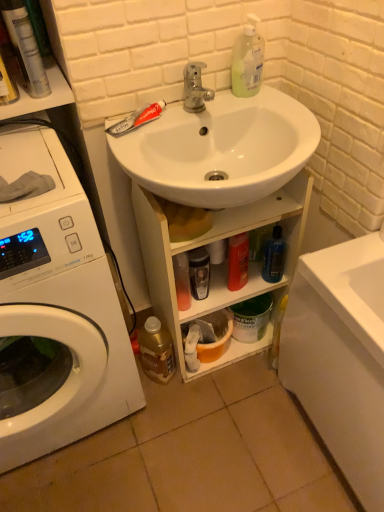
Question: Can you confirm if white glossy washing machine at left is positioned to the right of shiny black bottle at center, the 2th toiletry when ordered from back to front?

Choices:
 (A) yes
 (B) no

Answer: (B)

Question: Can shiny black bottle at center, the 2th toiletry when ordered from front to back, be found inside white glossy washing machine at left?

Choices:
 (A) yes
 (B) no

Answer: (B)

Question: From a real-world perspective, does white glossy washing machine at left stand above shiny black bottle at center, which appears as the 1th toiletry when ordered from the bottom?

Choices:
 (A) yes
 (B) no

Answer: (A)

Question: From the image's perspective, is white glossy washing machine at left located beneath shiny black bottle at center, arranged as the 2th toiletry when viewed from the right?

Choices:
 (A) no
 (B) yes

Answer: (B)

Question: Is white glossy washing machine at left facing towards shiny black bottle at center, the 2th toiletry viewed from the left?

Choices:
 (A) yes
 (B) no

Answer: (B)

Question: Does point (140, 336) appear closer or farther from the camera than point (271, 278)?

Choices:
 (A) closer
 (B) farther

Answer: (B)

Question: Is gold metallic bottle at lower left, positioned as the 2th bottle in top-to-bottom order, taller or shorter than blue translucent bottle at lower center, the first bottle positioned from the right?

Choices:
 (A) short
 (B) tall

Answer: (B)

Question: In terms of size, does gold metallic bottle at lower left, which ranks as the first bottle in left-to-right order, appear bigger or smaller than blue translucent bottle at lower center, the first bottle positioned from the right?

Choices:
 (A) small
 (B) big

Answer: (B)

Question: From a real-world perspective, is gold metallic bottle at lower left, the first bottle when ordered from bottom to top, physically located above or below blue translucent bottle at lower center, the 2th bottle from the left?

Choices:
 (A) above
 (B) below

Answer: (B)

Question: From a real-world perspective, is red matte toothpaste at upper left positioned above or below metallic silver spray can at upper left, the 3th toiletry positioned from the back?

Choices:
 (A) above
 (B) below

Answer: (B)

Question: Considering the positions of red matte toothpaste at upper left and metallic silver spray can at upper left, the first toiletry when ordered from left to right, in the image, is red matte toothpaste at upper left bigger or smaller than metallic silver spray can at upper left, the first toiletry when ordered from left to right,?

Choices:
 (A) small
 (B) big

Answer: (A)

Question: Is red matte toothpaste at upper left taller or shorter than metallic silver spray can at upper left, the first toiletry when ordered from left to right?

Choices:
 (A) short
 (B) tall

Answer: (A)

Question: From the image's perspective, is red matte toothpaste at upper left above or below metallic silver spray can at upper left, which appears as the 3th toiletry when ordered from the bottom?

Choices:
 (A) below
 (B) above

Answer: (A)

Question: Considering the relative positions of gold metallic bottle at lower left, positioned as the 2th bottle in top-to-bottom order, and white glossy washing machine at left in the image provided, is gold metallic bottle at lower left, positioned as the 2th bottle in top-to-bottom order, to the left or to the right of white glossy washing machine at left?

Choices:
 (A) left
 (B) right

Answer: (B)

Question: Do you think gold metallic bottle at lower left, the first bottle when ordered from bottom to top, is within white glossy washing machine at left, or outside of it?

Choices:
 (A) inside
 (B) outside

Answer: (B)